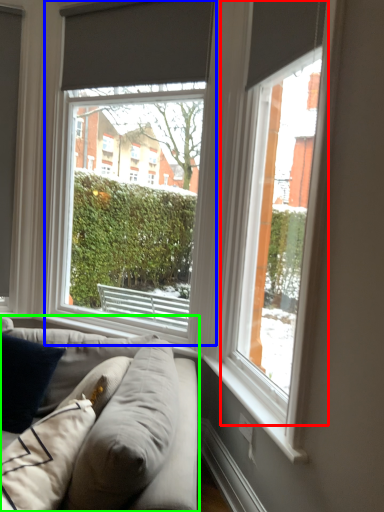
Question: Which object is the farthest from window (highlighted by a red box)? Choose among these: window (highlighted by a blue box) or studio couch (highlighted by a green box).

Choices:
 (A) window
 (B) studio couch

Answer: (A)